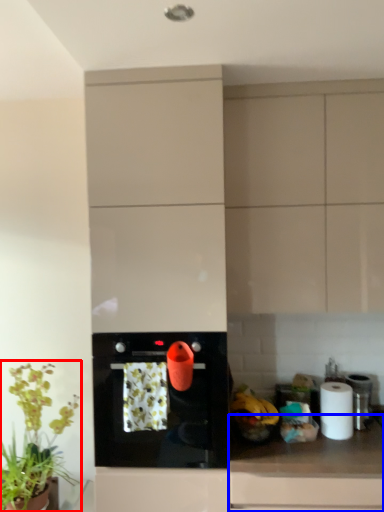
Question: Which of the following is the closest to the observer, houseplant (highlighted by a red box) or countertop (highlighted by a blue box)?

Choices:
 (A) houseplant
 (B) countertop

Answer: (B)